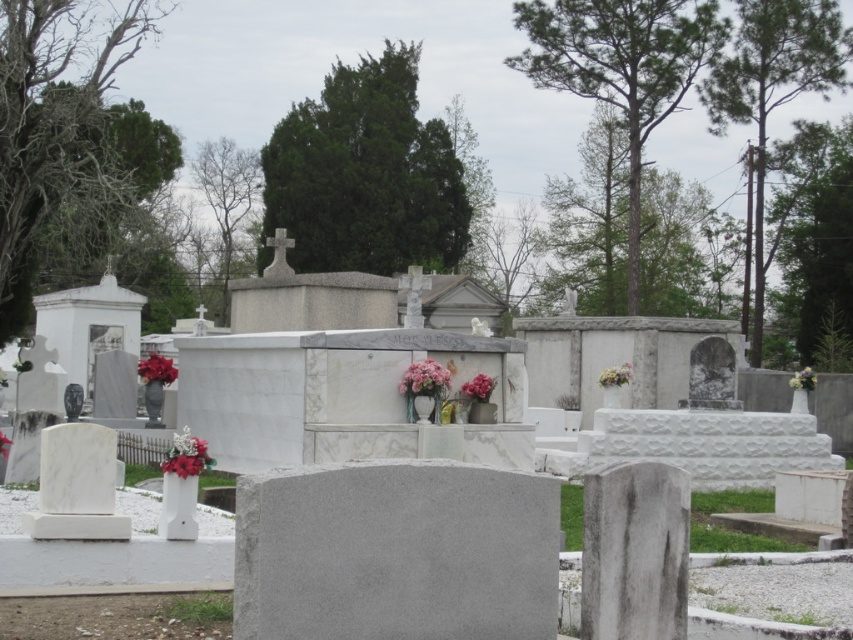
Which of these two, pink floral bouquet at center or red matte flower at center, stands shorter?

Standing shorter between the two is red matte flower at center.

Is the position of pink floral bouquet at center less distant than that of red matte flower at center?

No, it is behind red matte flower at center.

This screenshot has width=853, height=640. What do you see at coordinates (424, 378) in the screenshot?
I see `pink floral bouquet at center` at bounding box center [424, 378].

You are a GUI agent. You are given a task and a screenshot of the screen. Output one action in this format:
    pyautogui.click(x=<x>, y=<y>)
    Task: Click on the pink floral bouquet at center
    This screenshot has width=853, height=640.
    Given the screenshot: What is the action you would take?
    pyautogui.click(x=424, y=378)

Is gray marble gravestone at center behind matte red flowers at center-left?

No, gray marble gravestone at center is closer to the viewer.

Does gray marble gravestone at center have a greater width compared to matte red flowers at center-left?

Correct, the width of gray marble gravestone at center exceeds that of matte red flowers at center-left.

Image resolution: width=853 pixels, height=640 pixels. Describe the element at coordinates (395, 552) in the screenshot. I see `gray marble gravestone at center` at that location.

Where is `gray marble gravestone at center`? gray marble gravestone at center is located at coordinates (395, 552).

Which is more to the left, gray marble gravestone at center or red matte flower at center?

red matte flower at center

Can you confirm if gray marble gravestone at center is positioned below red matte flower at center?

Incorrect, gray marble gravestone at center is not positioned below red matte flower at center.

Between point (254, 634) and point (3, 444), which one is positioned behind?

The point (3, 444) is more distant.

This screenshot has width=853, height=640. I want to click on gray marble gravestone at center, so click(x=395, y=552).